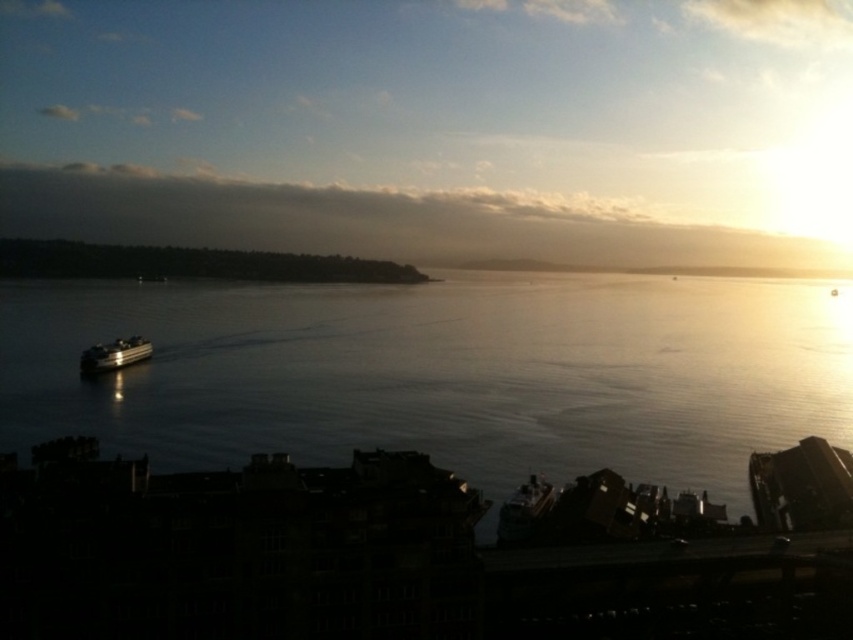
You are standing on the waterfront and want to take a photo of the shiny silver ferry at lower left and the clear water at center. Which object should you point your camera towards first to capture both in the same frame?

You should point your camera towards the shiny silver ferry at lower left first since the clear water at center is to the right of it, allowing both objects to be included in the frame.

You are a photographer trying to capture the reflection of the shiny silver ferry at lower left in the clear water at center. Based on the scene, will the reflection of the ferry be fully visible in the water?

Answer: The clear water at center is bigger than the shiny silver ferry at lower left, so the reflection of the ferry will be fully visible in the water.

You are standing at the waterfront and see two points marked in the scene. Which point, point (42, 342) or point (108, 368), is closer to you?

Point (42, 342) is further to the camera than point (108, 368), so the closer point to you is point (108, 368).